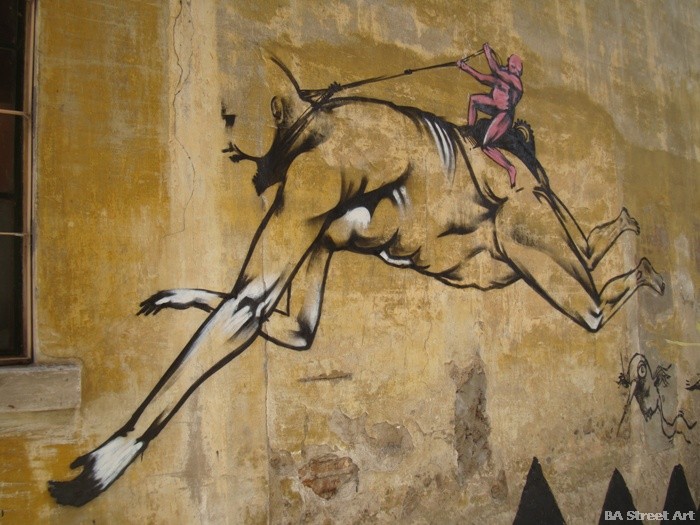
The height and width of the screenshot is (525, 700). Find the location of `wall`. wall is located at coordinates (152, 165).